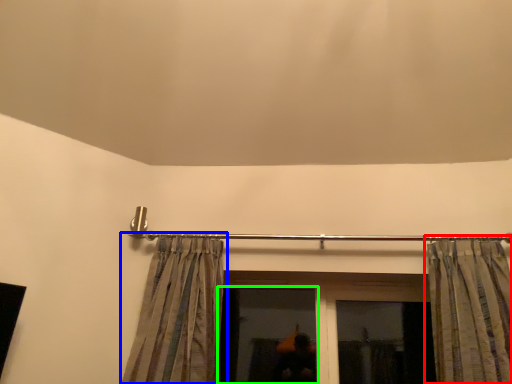
Question: Estimate the real-world distances between objects in this image. Which object is closer to curtain (highlighted by a red box), curtain (highlighted by a blue box) or window (highlighted by a green box)?

Choices:
 (A) curtain
 (B) window

Answer: (B)